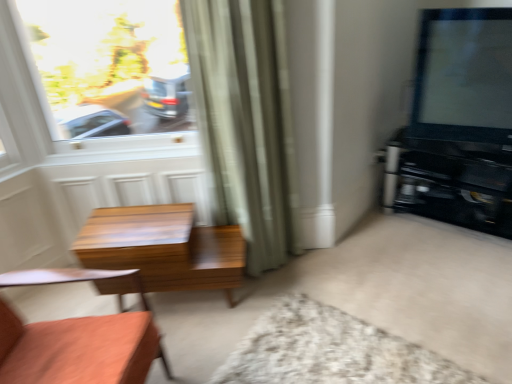
The width and height of the screenshot is (512, 384). Describe the element at coordinates (451, 183) in the screenshot. I see `black glossy entertainment center at right` at that location.

The image size is (512, 384). I want to click on clear glass window at upper left, so click(109, 66).

What do you see at coordinates (464, 76) in the screenshot? The width and height of the screenshot is (512, 384). I see `matte black tv at upper right` at bounding box center [464, 76].

Measure the distance between wooden chair at lower left and camera.

The depth of wooden chair at lower left is 4.34 feet.

The width and height of the screenshot is (512, 384). I want to click on white shaggy rug at lower center, so click(330, 351).

This screenshot has width=512, height=384. What do you see at coordinates (330, 351) in the screenshot?
I see `white shaggy rug at lower center` at bounding box center [330, 351].

This screenshot has width=512, height=384. Find the location of `black glossy entertainment center at right`. black glossy entertainment center at right is located at coordinates (451, 183).

Is matte black tv at upper right looking in the opposite direction of wooden chair at lower left?

matte black tv at upper right is not turned away from wooden chair at lower left.

Are matte black tv at upper right and wooden chair at lower left located far from each other?

Absolutely, matte black tv at upper right is distant from wooden chair at lower left.

From a real-world perspective, which object stands above the other?

matte black tv at upper right.

From their relative heights in the image, would you say matte black tv at upper right is taller or shorter than wooden chair at lower left?

Clearly, matte black tv at upper right is shorter compared to wooden chair at lower left.

From a real-world perspective, is white shaggy rug at lower center on top of wooden chair at lower left?

No, from a real-world perspective, white shaggy rug at lower center is not over wooden chair at lower left

Looking at this image, is white shaggy rug at lower center to the right of wooden chair at lower left from the viewer's perspective?

Indeed, white shaggy rug at lower center is positioned on the right side of wooden chair at lower left.

Can you confirm if white shaggy rug at lower center is bigger than wooden chair at lower left?

No, white shaggy rug at lower center is not bigger than wooden chair at lower left.

Considering the sizes of white shaggy rug at lower center and wooden chair at lower left in the image, is white shaggy rug at lower center taller or shorter than wooden chair at lower left?

Considering their sizes, white shaggy rug at lower center has less height than wooden chair at lower left.

Between wooden table at center and clear glass window at upper left, which one has larger size?

Bigger between the two is clear glass window at upper left.

Is wooden table at center to the left or to the right of clear glass window at upper left in the image?

In the image, wooden table at center appears on the right side of clear glass window at upper left.

Does wooden table at center contain clear glass window at upper left?

No.

How many degrees apart are the facing directions of wooden table at center and clear glass window at upper left?

1.74 degrees.

Can we say wooden chair at lower left lies outside white shaggy rug at lower center?

wooden chair at lower left lies outside white shaggy rug at lower center's area.

Which of these two, wooden chair at lower left or white shaggy rug at lower center, stands taller?

wooden chair at lower left is taller.

Is there a large distance between wooden chair at lower left and white shaggy rug at lower center?

wooden chair at lower left is near white shaggy rug at lower center, not far away.

Which is in front, point (114, 380) or point (279, 374)?

Positioned in front is point (114, 380).

What's the angular difference between clear glass window at upper left and white shaggy rug at lower center's facing directions?

34.7 degrees.

From a real-world perspective, who is located lower, clear glass window at upper left or white shaggy rug at lower center?

From a 3D spatial view, white shaggy rug at lower center is below.

Is clear glass window at upper left located outside white shaggy rug at lower center?

Yes, clear glass window at upper left is outside of white shaggy rug at lower center.

Which object is positioned more to the left, clear glass window at upper left or white shaggy rug at lower center?

clear glass window at upper left is more to the left.

How distant is wooden chair at lower left from black glossy entertainment center at right?

6.32 feet.

From the image's perspective, is wooden chair at lower left on black glossy entertainment center at right?

Actually, wooden chair at lower left appears below black glossy entertainment center at right in the image.

From the picture: Who is taller, wooden chair at lower left or black glossy entertainment center at right?

wooden chair at lower left.

Considering the relative sizes of wooden chair at lower left and black glossy entertainment center at right in the image provided, is wooden chair at lower left thinner than black glossy entertainment center at right?

In fact, wooden chair at lower left might be wider than black glossy entertainment center at right.

Is black glossy entertainment center at right directly adjacent to green fabric curtain at center?

No, black glossy entertainment center at right is not in contact with green fabric curtain at center.

How many degrees apart are the facing directions of black glossy entertainment center at right and green fabric curtain at center?

The facing directions of black glossy entertainment center at right and green fabric curtain at center are 35.4 degrees apart.

From a real-world perspective, between black glossy entertainment center at right and green fabric curtain at center, who is vertically higher?

From a 3D spatial view, green fabric curtain at center is above.

In the image, is black glossy entertainment center at right positioned in front of or behind green fabric curtain at center?

In the image, black glossy entertainment center at right appears behind green fabric curtain at center.

The height and width of the screenshot is (384, 512). In the image, there is a matte black tv at upper right. In order to click on chair below it (from a real-world perspective) in this screenshot , I will do `click(77, 338)`.

Find the location of a particular element. Image resolution: width=512 pixels, height=384 pixels. chair on the left side of white shaggy rug at lower center is located at coordinates (77, 338).

Based on their spatial positions, is matte black tv at upper right or wooden chair at lower left closer to wooden table at center?

Among the two, wooden chair at lower left is located nearer to wooden table at center.

Which object lies further to the anchor point black glossy entertainment center at right, wooden table at center or green fabric curtain at center?

wooden table at center lies further to black glossy entertainment center at right than the other object.

Looking at the image, which one is located further to green fabric curtain at center, black glossy entertainment center at right or wooden chair at lower left?

black glossy entertainment center at right is further to green fabric curtain at center.

Considering their positions, is green fabric curtain at center positioned closer to wooden table at center than clear glass window at upper left?

Based on the image, green fabric curtain at center appears to be nearer to wooden table at center.

Estimate the real-world distances between objects in this image. Which object is closer to black glossy entertainment center at right, wooden chair at lower left or white shaggy rug at lower center?

white shaggy rug at lower center is positioned closer to the anchor black glossy entertainment center at right.

Based on the photo, which object lies further to the anchor point black glossy entertainment center at right, clear glass window at upper left or wooden chair at lower left?

Based on the image, wooden chair at lower left appears to be further to black glossy entertainment center at right.

From the image, which object appears to be nearer to white shaggy rug at lower center, clear glass window at upper left or black glossy entertainment center at right?

black glossy entertainment center at right is positioned closer to the anchor white shaggy rug at lower center.

Estimate the real-world distances between objects in this image. Which object is further from clear glass window at upper left, wooden chair at lower left or matte black tv at upper right?

matte black tv at upper right lies further to clear glass window at upper left than the other object.

Find the location of a particular element. This screenshot has width=512, height=384. table located between clear glass window at upper left and black glossy entertainment center at right in the left-right direction is located at coordinates (164, 248).

Locate an element on the screen. This screenshot has width=512, height=384. window screen between clear glass window at upper left and black glossy entertainment center at right in the horizontal direction is located at coordinates (464, 76).

Where is `window screen located between wooden chair at lower left and black glossy entertainment center at right in the left-right direction`? Image resolution: width=512 pixels, height=384 pixels. window screen located between wooden chair at lower left and black glossy entertainment center at right in the left-right direction is located at coordinates [x=464, y=76].

Where is `plain between wooden table at center and matte black tv at upper right from left to right`? Image resolution: width=512 pixels, height=384 pixels. plain between wooden table at center and matte black tv at upper right from left to right is located at coordinates (330, 351).